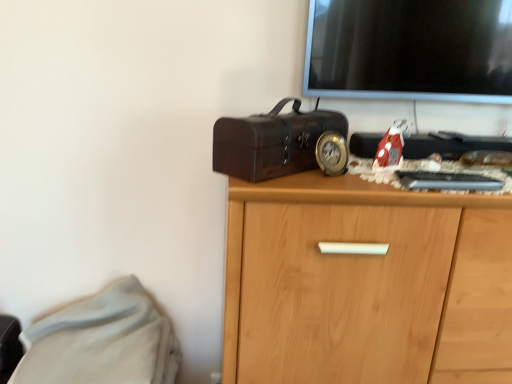
In order to face light wood cabinet at center, should I rotate leftwards or rightwards?

Turn right by 20.012 degrees to look at light wood cabinet at center.

What is the approximate height of shiny dark brown suitcase at center?

It is 5.83 inches.

This screenshot has height=384, width=512. I want to click on shiny dark brown suitcase at center, so click(x=272, y=142).

At what (x,y) coordinates should I click in order to perform the action: click on light wood cabinet at center. Please return your answer as a coordinate pair (x, y). Image resolution: width=512 pixels, height=384 pixels. Looking at the image, I should click on (366, 284).

The height and width of the screenshot is (384, 512). What are the coordinates of `bed beneath the light wood cabinet at center (from a real-world perspective)` in the screenshot? It's located at [102, 341].

From the image's perspective, who appears lower, white soft fabric at lower left or light wood cabinet at center?

white soft fabric at lower left is shown below in the image.

Does point (156, 328) appear closer or farther from the camera than point (369, 261)?

Point (156, 328) appears to be farther away from the viewer than point (369, 261).

Is light wood cabinet at center looking in the opposite direction of shiny dark brown suitcase at center?

A: light wood cabinet at center does not have its back to shiny dark brown suitcase at center.

Does light wood cabinet at center have a lesser height compared to shiny dark brown suitcase at center?

Incorrect, the height of light wood cabinet at center does not fall short of that of shiny dark brown suitcase at center.

Does light wood cabinet at center appear on the right side of shiny dark brown suitcase at center?

Correct, you'll find light wood cabinet at center to the right of shiny dark brown suitcase at center.

Is light wood cabinet at center positioned beyond the bounds of shiny dark brown suitcase at center?

light wood cabinet at center lies outside shiny dark brown suitcase at center's area.

From a real-world perspective, is light wood cabinet at center positioned under white soft fabric at lower left based on gravity?

No, from a real-world perspective, light wood cabinet at center is not below white soft fabric at lower left.

Between light wood cabinet at center and white soft fabric at lower left, which one appears on the right side from the viewer's perspective?

light wood cabinet at center is more to the right.

Is light wood cabinet at center outside of white soft fabric at lower left?

Yes, light wood cabinet at center is outside of white soft fabric at lower left.

Would you say shiny dark brown suitcase at center is a long distance from white soft fabric at lower left?

No, shiny dark brown suitcase at center is not far away from white soft fabric at lower left.

Is shiny dark brown suitcase at center oriented towards white soft fabric at lower left?

No, shiny dark brown suitcase at center is not facing towards white soft fabric at lower left.

Which of these two, shiny dark brown suitcase at center or white soft fabric at lower left, stands shorter?

With less height is shiny dark brown suitcase at center.

Between shiny dark brown suitcase at center and white soft fabric at lower left, which one has larger width?

white soft fabric at lower left is wider.

Which object is closer to the camera taking this photo, white soft fabric at lower left or shiny dark brown suitcase at center?

shiny dark brown suitcase at center is more forward.

Considering the relative sizes of white soft fabric at lower left and shiny dark brown suitcase at center in the image provided, is white soft fabric at lower left wider than shiny dark brown suitcase at center?

Yes.

Is white soft fabric at lower left shorter than shiny dark brown suitcase at center?

In fact, white soft fabric at lower left may be taller than shiny dark brown suitcase at center.

Between point (168, 357) and point (257, 181), which one is positioned behind?

Point (168, 357)

Consider the image. Can you confirm if shiny dark brown suitcase at center is positioned to the right of light wood cabinet at center?

No, shiny dark brown suitcase at center is not to the right of light wood cabinet at center.

Consider the image. From the image's perspective, between shiny dark brown suitcase at center and light wood cabinet at center, who is located below?

light wood cabinet at center, from the image's perspective.

Where is `chest of drawers behind the shiny dark brown suitcase at center`? Image resolution: width=512 pixels, height=384 pixels. chest of drawers behind the shiny dark brown suitcase at center is located at coordinates (366, 284).

The height and width of the screenshot is (384, 512). Identify the location of bed on the left of light wood cabinet at center. (102, 341).

Identify the location of chest of drawers on the right of shiny dark brown suitcase at center. (x=366, y=284).

Considering their positions, is shiny dark brown suitcase at center positioned further to light wood cabinet at center than white soft fabric at lower left?

The object further to light wood cabinet at center is white soft fabric at lower left.

Based on their spatial positions, is light wood cabinet at center or white soft fabric at lower left closer to shiny dark brown suitcase at center?

light wood cabinet at center is closer to shiny dark brown suitcase at center.

Estimate the real-world distances between objects in this image. Which object is closer to shiny dark brown suitcase at center, white soft fabric at lower left or light wood cabinet at center?

The object closer to shiny dark brown suitcase at center is light wood cabinet at center.

When comparing their distances from light wood cabinet at center, does white soft fabric at lower left or shiny dark brown suitcase at center seem further?

white soft fabric at lower left.

Which object lies nearer to the anchor point white soft fabric at lower left, light wood cabinet at center or shiny dark brown suitcase at center?

light wood cabinet at center is closer to white soft fabric at lower left.

Considering their positions, is shiny dark brown suitcase at center positioned further to white soft fabric at lower left than light wood cabinet at center?

shiny dark brown suitcase at center.

In order to click on suitcase between white soft fabric at lower left and light wood cabinet at center from left to right in this screenshot , I will do `click(272, 142)`.